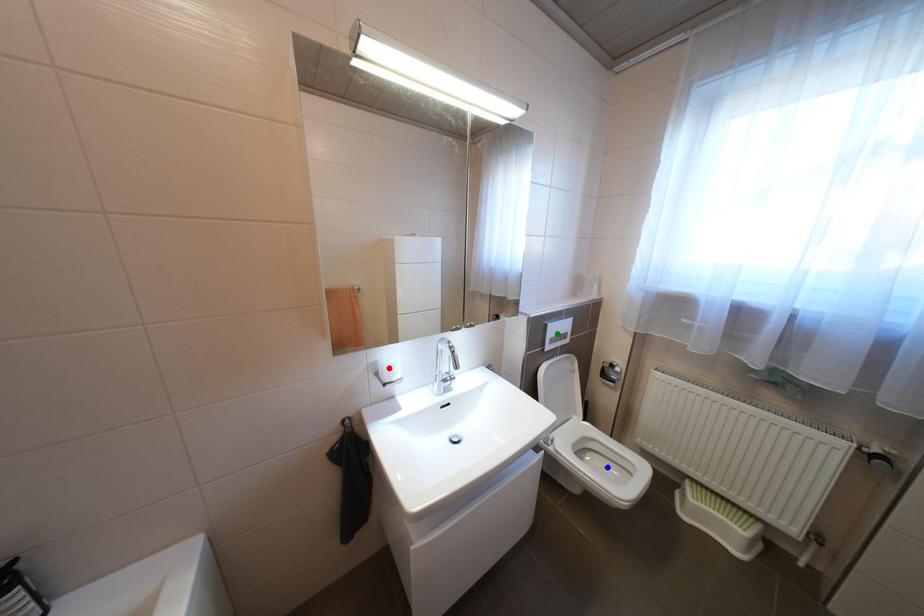
Order these from nearest to farthest:
green point | red point | blue point

red point
green point
blue point